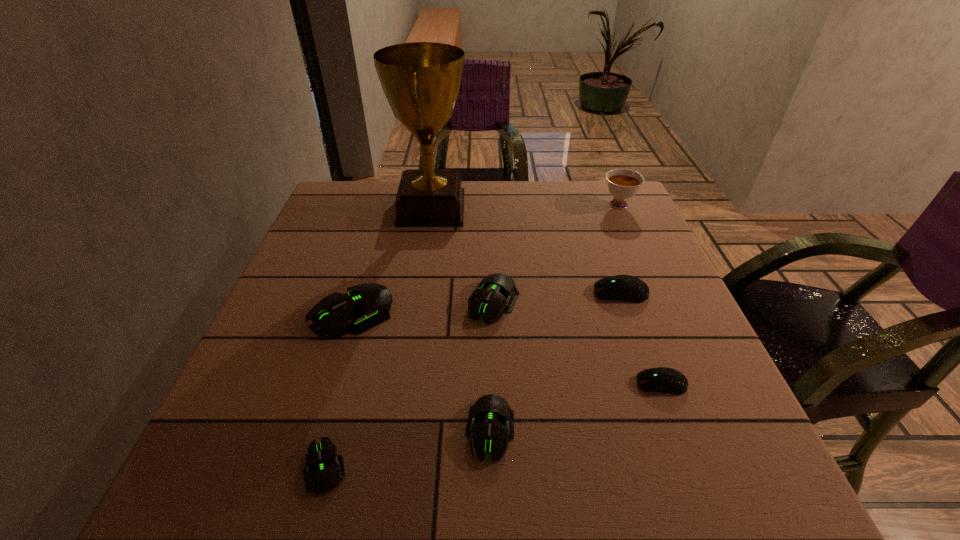
Locate an element on the screen. The height and width of the screenshot is (540, 960). object that is at the far right corner is located at coordinates (622, 184).

This screenshot has height=540, width=960. I want to click on free space at the far edge of the desktop, so click(575, 195).

Where is `free spot at the near edge of the desktop`? Image resolution: width=960 pixels, height=540 pixels. free spot at the near edge of the desktop is located at coordinates (513, 467).

Locate an element on the screen. The height and width of the screenshot is (540, 960). free spot at the left edge of the desktop is located at coordinates (331, 254).

The image size is (960, 540). Identify the location of vacant area at the right edge of the desktop. (669, 329).

Where is `free space at the far left corner of the desktop`? This screenshot has height=540, width=960. free space at the far left corner of the desktop is located at coordinates [325, 207].

Where is `free space between the second biggest gray computer mouse and the farther dark computer equipment`? free space between the second biggest gray computer mouse and the farther dark computer equipment is located at coordinates (558, 298).

Locate an element on the screen. The image size is (960, 540). empty space that is in between the fourth farthest computer mouse and the bigger dark computer equipment is located at coordinates (641, 339).

Find the location of a particular element. This screenshot has height=540, width=960. empty space between the second smallest gray computer mouse and the teacup is located at coordinates (554, 318).

Locate an element on the screen. The image size is (960, 540). free area in between the biggest gray computer mouse and the second biggest gray computer mouse is located at coordinates (423, 308).